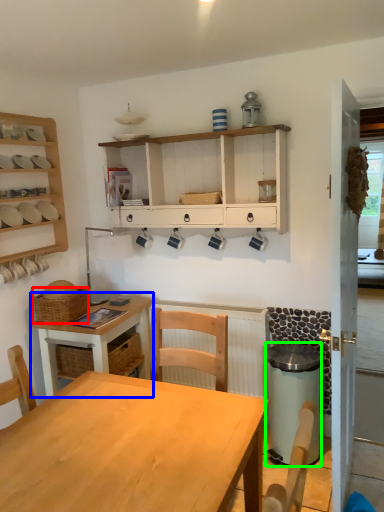
Question: Which object is positioned closest to basket (highlighted by a red box)? Select from desk (highlighted by a blue box) and trash bin/can (highlighted by a green box).

Choices:
 (A) desk
 (B) trash bin/can

Answer: (A)